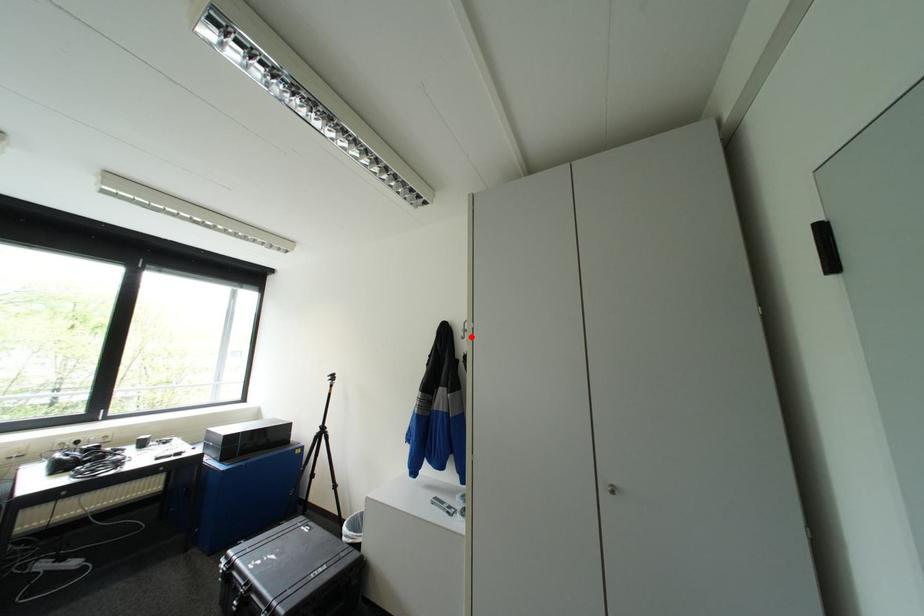
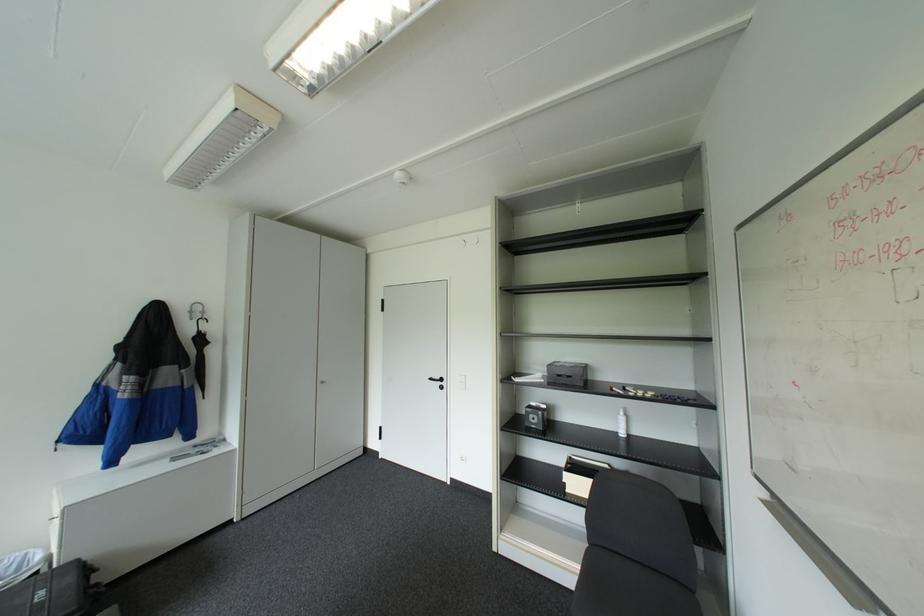
Find the pixel in the second image that matches the highlighted location in the first image.

(200, 318)